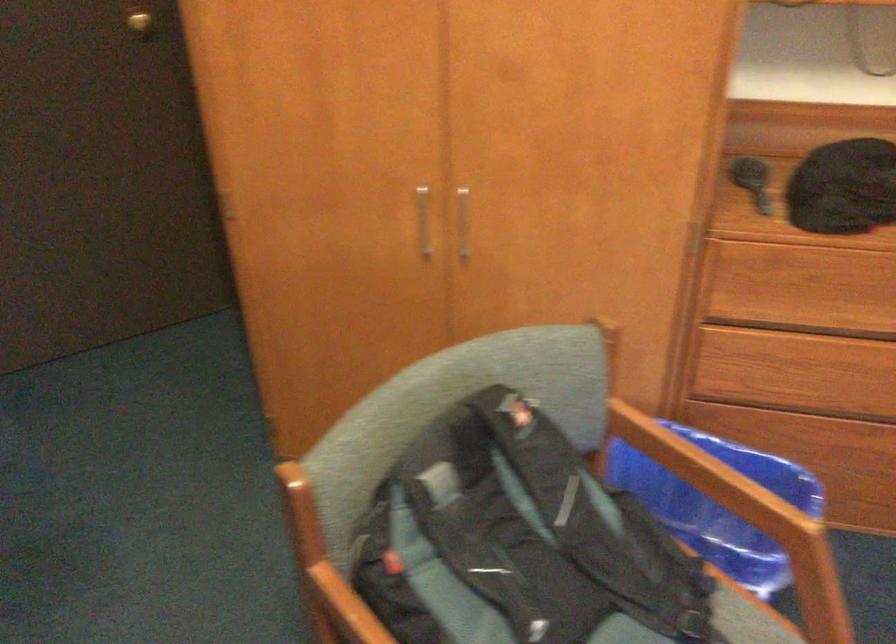
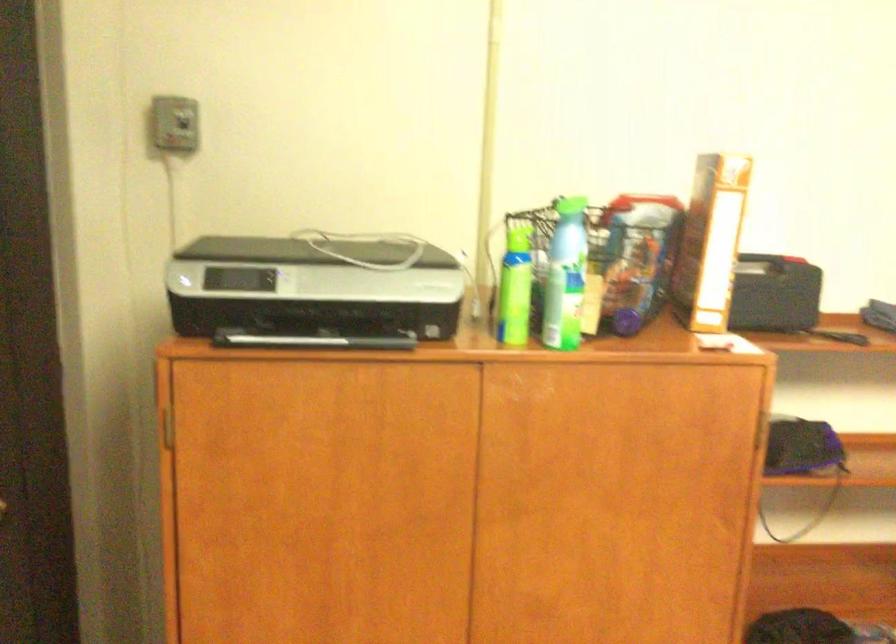
The first image is from the beginning of the video and the second image is from the end. How did the camera likely rotate when shooting the video?

The rotation direction of the camera is right-up.